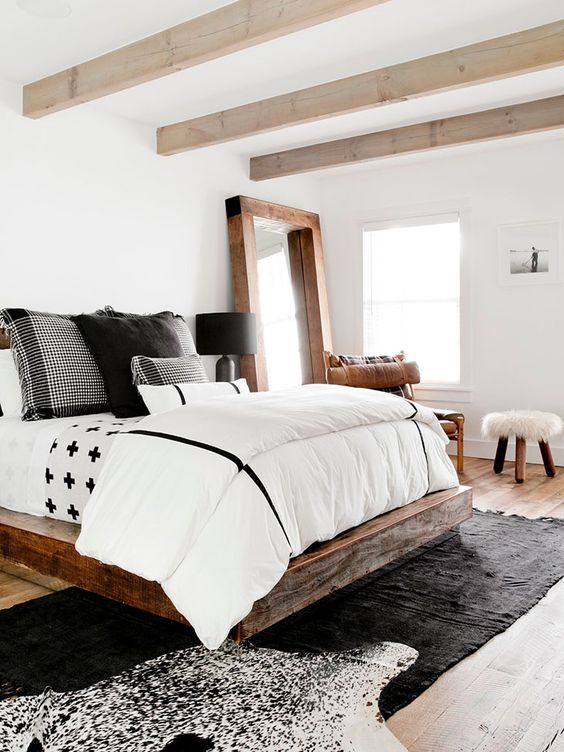
At what (x,y) coordinates should I click in order to perform the action: click on white carpet. Please return your answer as a coordinate pair (x, y). The image size is (564, 752). Looking at the image, I should click on (356, 704).